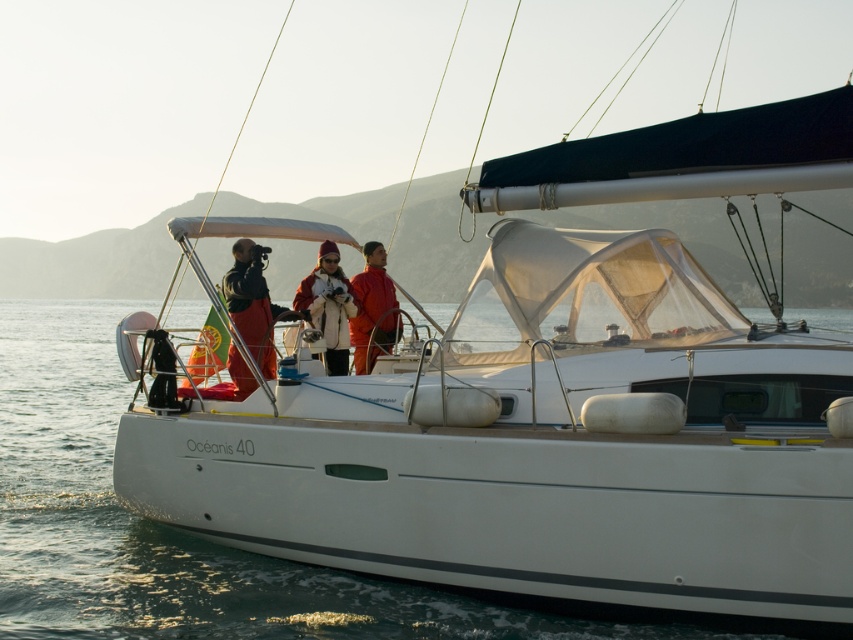
You are a passenger on the Oceanis 40 sailboat and want to take a photo of the sunset. You notice two jackets on deck. Which jacket is easier to reach without moving from your current position? The dark brown leather jacket at center or the matte orange jacket at center?

The dark brown leather jacket at center is closer to the viewer than the matte orange jacket at center, so it is easier to reach without moving.

You are standing on the dock preparing to board the Oceanis 40 sailboat. The dark brown leather jacket at center is currently occupied by a crew member. If you want to hand them a waterproof bag without getting too close, what is the maximum distance you should maintain to ensure they can still reach it?

The dark brown leather jacket at center is 8.16 meters away from the viewer. To ensure the crew member can reach the waterproof bag, you should maintain a distance no greater than 8.16 meters.

You are a sailor on the Oceanis 40 and need to secure a rope that is as wide as the matte red coat at center. Can the clear water at center accommodate the rope without overlapping the coat?

The clear water at center might be wider than matte red coat at center, so the rope could fit without overlapping the coat if placed correctly.